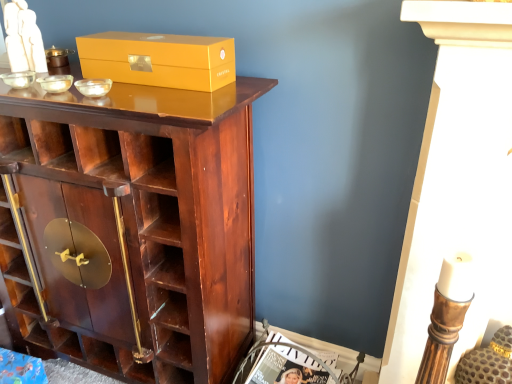
Question: Could you tell me if matte white magazine at lower center is facing matte gold box at upper center?

Choices:
 (A) yes
 (B) no

Answer: (B)

Question: Are matte white magazine at lower center and matte gold box at upper center located far from each other?

Choices:
 (A) no
 (B) yes

Answer: (A)

Question: Is matte white magazine at lower center completely or partially outside of matte gold box at upper center?

Choices:
 (A) no
 (B) yes

Answer: (B)

Question: Can you confirm if matte white magazine at lower center is taller than matte gold box at upper center?

Choices:
 (A) yes
 (B) no

Answer: (A)

Question: Is matte white magazine at lower center facing away from matte gold box at upper center?

Choices:
 (A) no
 (B) yes

Answer: (A)

Question: Is matte white magazine at lower center in contact with matte gold box at upper center?

Choices:
 (A) yes
 (B) no

Answer: (B)

Question: Is the position of matte gold box at upper center more distant than that of shiny dark wood cupboard at center?

Choices:
 (A) yes
 (B) no

Answer: (A)

Question: From the image's perspective, is matte gold box at upper center over shiny dark wood cupboard at center?

Choices:
 (A) no
 (B) yes

Answer: (B)

Question: From a real-world perspective, is matte gold box at upper center positioned over shiny dark wood cupboard at center based on gravity?

Choices:
 (A) no
 (B) yes

Answer: (B)

Question: From a real-world perspective, is matte gold box at upper center below shiny dark wood cupboard at center?

Choices:
 (A) no
 (B) yes

Answer: (A)

Question: From the image's perspective, would you say matte gold box at upper center is shown under shiny dark wood cupboard at center?

Choices:
 (A) yes
 (B) no

Answer: (B)

Question: Is matte gold box at upper center not close to shiny dark wood cupboard at center?

Choices:
 (A) yes
 (B) no

Answer: (B)

Question: Can you confirm if matte gold box at upper center is wider than matte white magazine at lower center?

Choices:
 (A) yes
 (B) no

Answer: (B)